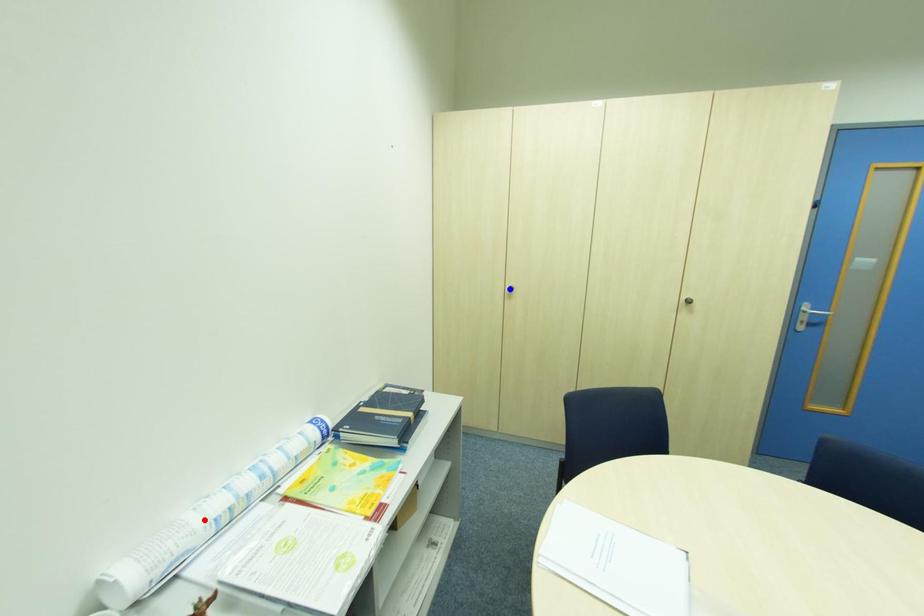
Question: Which of the two points in the image is closer to the camera?

Choices:
 (A) Blue point is closer.
 (B) Red point is closer.

Answer: (B)